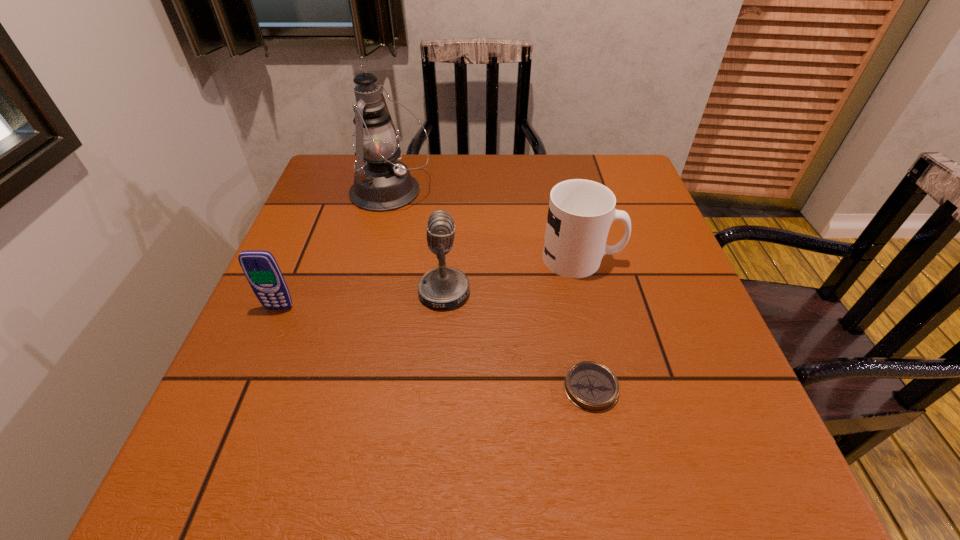
Where is `vacant region at the left edge of the desktop`? The width and height of the screenshot is (960, 540). vacant region at the left edge of the desktop is located at coordinates (308, 375).

The width and height of the screenshot is (960, 540). Identify the location of free space at the right edge of the desktop. (693, 330).

Image resolution: width=960 pixels, height=540 pixels. In order to click on vacant space at the near left corner of the desktop in this screenshot , I will do `click(257, 469)`.

At what (x,y) coordinates should I click in order to perform the action: click on free region at the far right corner of the desktop. Please return your answer as a coordinate pair (x, y). Looking at the image, I should click on (587, 170).

Where is `free space at the near right corner of the desktop`? This screenshot has width=960, height=540. free space at the near right corner of the desktop is located at coordinates (727, 457).

In order to click on vacant space that is in between the microphone and the cellular telephone in this screenshot , I will do `click(362, 300)`.

This screenshot has width=960, height=540. I want to click on vacant space in between the tallest object and the cellular telephone, so click(x=335, y=250).

This screenshot has height=540, width=960. Identify the location of free space between the nearest object and the farthest object. (491, 290).

At what (x,y) coordinates should I click in order to perform the action: click on free point between the fourth object from right to left and the cellular telephone. Please return your answer as a coordinate pair (x, y). The image size is (960, 540). Looking at the image, I should click on (335, 250).

Where is `free area in between the farthest object and the leftmost object`? This screenshot has width=960, height=540. free area in between the farthest object and the leftmost object is located at coordinates (335, 250).